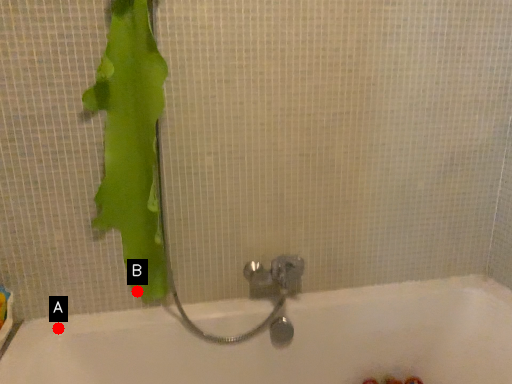
Question: Two points are circled on the image, labeled by A and B beside each circle. Which point is farther from the camera taking this photo?

Choices:
 (A) A is further
 (B) B is further

Answer: (B)